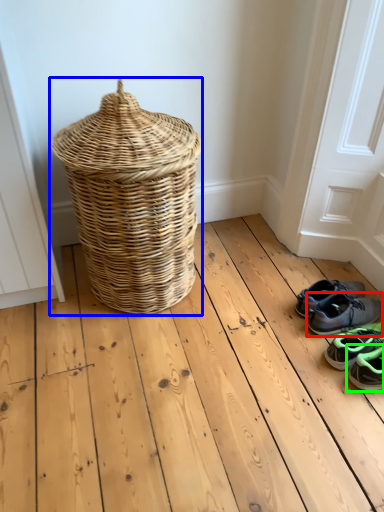
Question: Based on their relative distances, which object is nearer to footwear (highlighted by a red box)? Choose from picnic basket (highlighted by a blue box) and footwear (highlighted by a green box).

Choices:
 (A) picnic basket
 (B) footwear

Answer: (B)